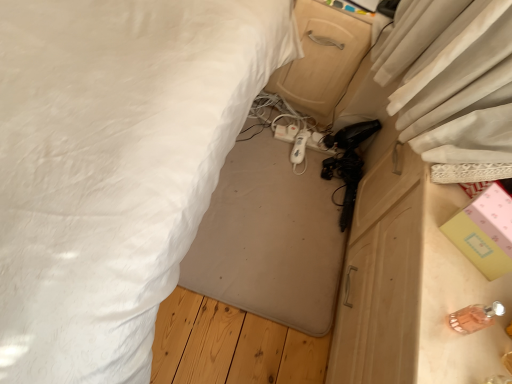
This screenshot has width=512, height=384. I want to click on free space to the right of translucent glass perfume bottle at lower right, marked as the first equipment in a front-to-back arrangement, so click(x=489, y=336).